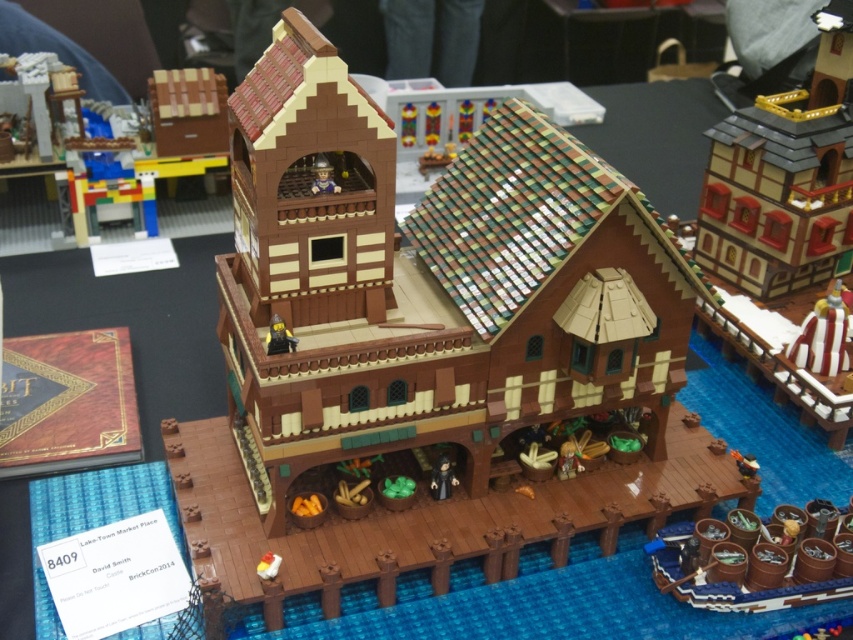
Question: From the image, what is the correct spatial relationship of wooden barrels at lower right in relation to smooth black figure at lower center?

Choices:
 (A) left
 (B) right

Answer: (B)

Question: Can you confirm if brown wood building at center is positioned above smooth black figure at lower center?

Choices:
 (A) no
 (B) yes

Answer: (B)

Question: Among these points, which one is farthest from the camera?

Choices:
 (A) (415, 525)
 (B) (445, 460)

Answer: (B)

Question: Which object is the closest to the brown wood building at center?

Choices:
 (A) smooth black figure at lower center
 (B) matte brown minifigure at center
 (C) matte brown building at upper right

Answer: (A)

Question: Which is farther from the smooth black figure at lower center?

Choices:
 (A) brown wood building at center
 (B) wooden barrels at lower right
 (C) matte brown minifigure at upper center

Answer: (C)

Question: Can you confirm if wooden barrels at lower right is positioned below matte brown minifigure at center?

Choices:
 (A) yes
 (B) no

Answer: (A)